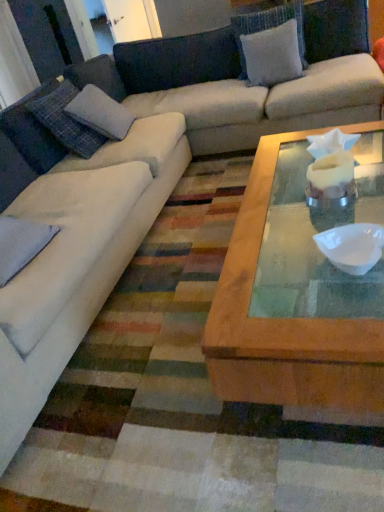
Question: Can you confirm if white fabric pillow at upper center, which is counted as the third pillow, starting from the bottom, is positioned to the left of plaid fabric pillow at left, arranged as the third pillow when viewed from the right?

Choices:
 (A) no
 (B) yes

Answer: (A)

Question: Can you confirm if white fabric pillow at upper center, acting as the first pillow starting from the right, is wider than plaid fabric pillow at left, acting as the second pillow starting from the top?

Choices:
 (A) yes
 (B) no

Answer: (A)

Question: Is white fabric pillow at upper center, which is counted as the third pillow, starting from the bottom, not close to plaid fabric pillow at left, the second pillow in the bottom-to-top sequence?

Choices:
 (A) yes
 (B) no

Answer: (A)

Question: Considering the relative sizes of white fabric pillow at upper center, the first pillow viewed from the top, and plaid fabric pillow at left, arranged as the third pillow when viewed from the right, in the image provided, is white fabric pillow at upper center, the first pillow viewed from the top, taller than plaid fabric pillow at left, arranged as the third pillow when viewed from the right,?

Choices:
 (A) yes
 (B) no

Answer: (B)

Question: Is white fabric pillow at upper center, acting as the first pillow starting from the right, oriented towards plaid fabric pillow at left, arranged as the 2th pillow when viewed from the front?

Choices:
 (A) yes
 (B) no

Answer: (B)

Question: Is white fabric pillow at upper center, which is counted as the third pillow, starting from the bottom, thinner than plaid fabric pillow at left, acting as the second pillow starting from the top?

Choices:
 (A) no
 (B) yes

Answer: (A)

Question: Is plaid fabric pillow at left, acting as the second pillow starting from the top, to the left of white fabric pillow at upper center, which ranks as the 1th pillow in back-to-front order, from the viewer's perspective?

Choices:
 (A) yes
 (B) no

Answer: (A)

Question: Is white fabric pillow at upper center, which ranks as the 1th pillow in back-to-front order, inside plaid fabric pillow at left, arranged as the 2th pillow when viewed from the front?

Choices:
 (A) yes
 (B) no

Answer: (B)

Question: Considering the relative sizes of plaid fabric pillow at left, the second pillow in the bottom-to-top sequence, and white fabric pillow at upper center, which ranks as the 1th pillow in back-to-front order, in the image provided, is plaid fabric pillow at left, the second pillow in the bottom-to-top sequence, thinner than white fabric pillow at upper center, which ranks as the 1th pillow in back-to-front order,?

Choices:
 (A) no
 (B) yes

Answer: (B)

Question: Could you tell me if plaid fabric pillow at left, arranged as the third pillow when viewed from the right, is turned towards white fabric pillow at upper center, the first pillow viewed from the top?

Choices:
 (A) yes
 (B) no

Answer: (A)

Question: From a real-world perspective, does plaid fabric pillow at left, the second pillow in the bottom-to-top sequence, stand above white fabric pillow at upper center, marked as the 3th pillow in a left-to-right arrangement?

Choices:
 (A) no
 (B) yes

Answer: (B)

Question: Is plaid fabric pillow at left, arranged as the 2th pillow when viewed from the front, outside white fabric pillow at upper center, marked as the third pillow in a front-to-back arrangement?

Choices:
 (A) no
 (B) yes

Answer: (B)

Question: Is white fabric pillow at upper center, marked as the third pillow in a front-to-back arrangement, positioned beyond the bounds of white matte bowl at center?

Choices:
 (A) yes
 (B) no

Answer: (A)